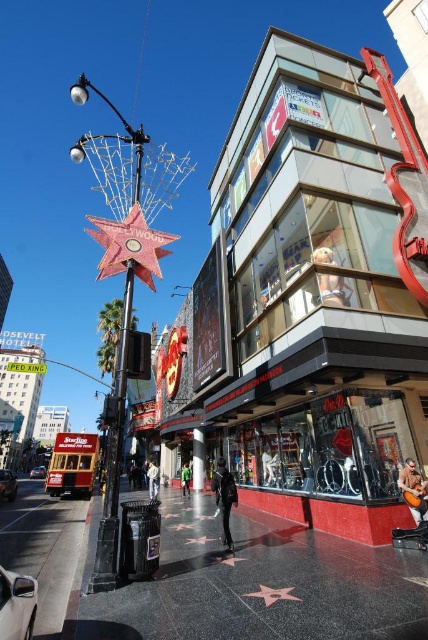
Can you confirm if pink polished star at center is positioned below gold reflective star at center?

No.

Looking at this image, between pink polished star at center and gold reflective star at center, which one is positioned higher?

Positioned higher is pink polished star at center.

Does point (284, 596) come in front of point (222, 561)?

Yes.

This screenshot has height=640, width=428. In order to click on pink polished star at center in this screenshot , I will do `click(273, 595)`.

Does smooth asphalt pavement at lower left come behind pink polished star at center?

No, smooth asphalt pavement at lower left is closer to the viewer.

Is smooth asphalt pavement at lower left above pink polished star at center?

No.

I want to click on smooth asphalt pavement at lower left, so click(x=44, y=548).

Is concrete sidewalk at center wider than pink polished star at center?

Yes, concrete sidewalk at center is wider than pink polished star at center.

Where is `concrete sidewalk at center`? This screenshot has width=428, height=640. concrete sidewalk at center is located at coordinates (261, 582).